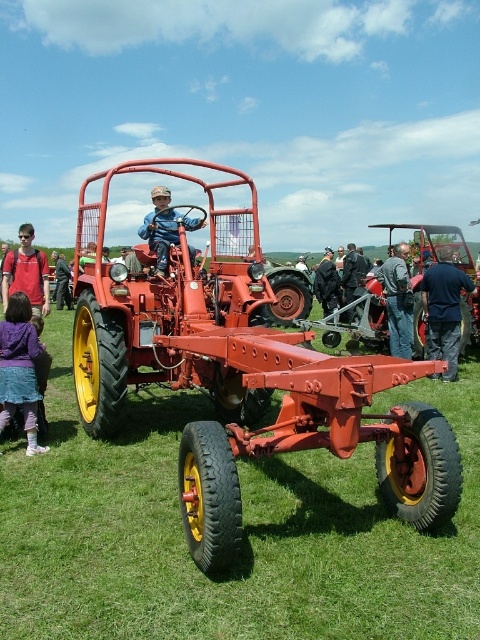
You are a photographer at the event and want to capture a closeup of the purple fabric dress at lower left and the matte red shirt at left. Which one do you need to zoom in more on to get a clear picture?

The purple fabric dress at lower left is thinner than the matte red shirt at left, so you need to zoom in more on the purple fabric dress at lower left to capture its details clearly.

You are a photographer standing 2 meters away from the matte red tractor at center. You want to take a photo of the dark blue shirt at center without the tractor blocking the view. Can you move backward to achieve this?

The matte red tractor at center is 3.91 meters away from the dark blue shirt at center. If you are currently 2 meters away from the tractor, moving backward would increase your distance from both objects. To ensure the tractor doesn not block the view, you need to be positioned such that the distance between you and the tractor is greater than 3.91 meters. Since you are only 2 meters away, moving back to at least 3.91 meters would allow the tractor to no longer block the shirt, but you would need to be even

You are a photographer at the event and want to capture a photo that includes both the purple fabric dress at lower left and the matte red shirt at left. The camera you are using has a maximum focus range that can cover up to 30 inches. Will you be able to fit both subjects within the camera focus range?

The distance between the purple fabric dress at lower left and the matte red shirt at left is 31.18 inches, which exceeds the camera focus range of 30 inches. Therefore, you cannot fit both subjects within the camera focus range.